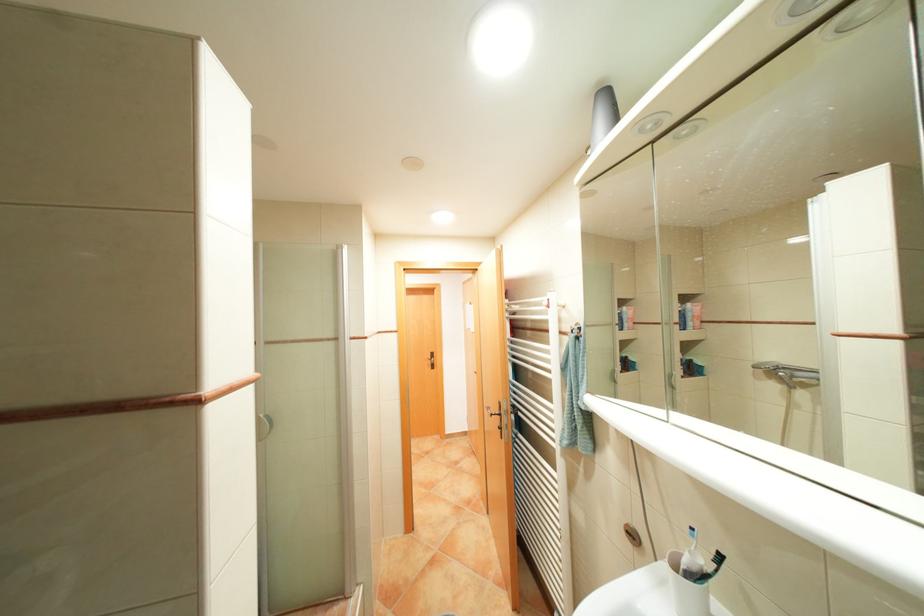
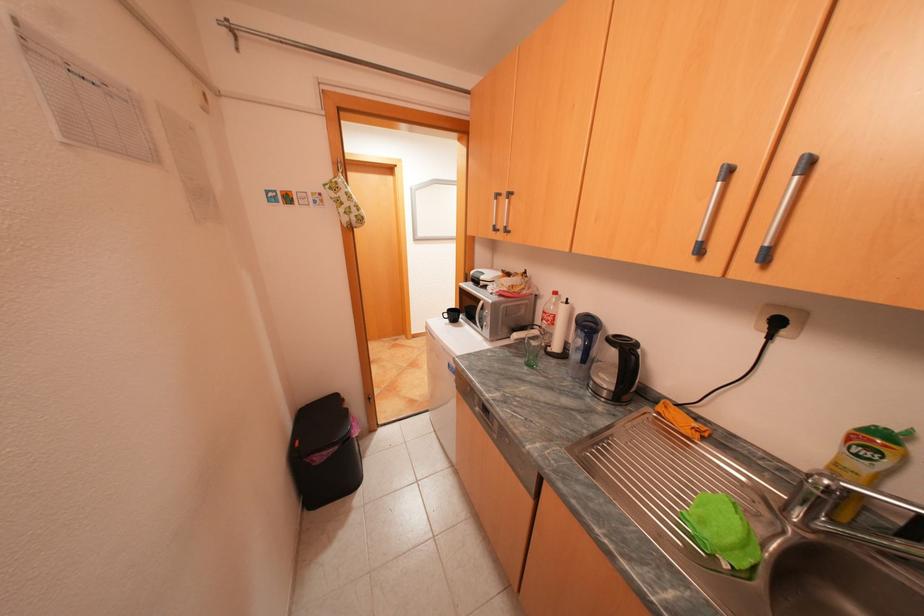
Question: What movement of the cameraman would produce the second image?

Choices:
 (A) Left
 (B) Right
 (C) Forward
 (D) Backward

Answer: (A)